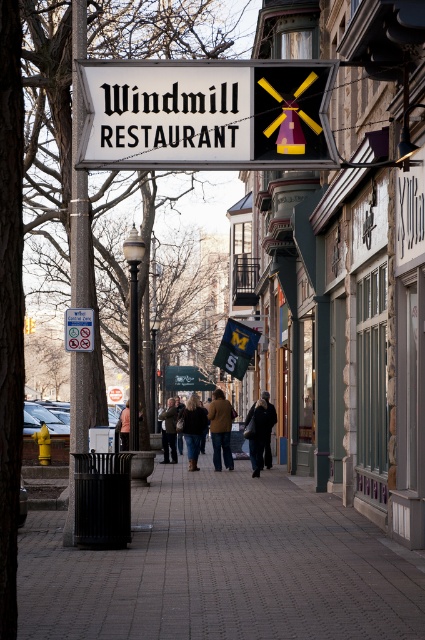
You are standing on the sidewalk of the urban street scene described. You want to read the matte black sign at upper center clearly. Considering the distance between you and the sign, is it possible to read the text on the sign without moving closer?

The matte black sign at upper center is 13.26 meters away from the viewer. At this distance, it may be challenging to read the text clearly without moving closer, as standard sign legibility typically requires closer proximity.

You are a delivery person trying to find the entrance to the Windmill Restaurant. You see the paved brick sidewalk at center and the matte black sign at upper center. According to the scene, which object is positioned lower in the image?

The paved brick sidewalk at center is located below the matte black sign at upper center, so the paved brick sidewalk at center is positioned lower in the image.

You are standing on the sidewalk in front of the Windmill Restaurant, and you notice two points marked on the cobblestone street. The first point is at coordinates point [189,586] and the second is at point [306,150]. Which of these two points is closer to you?

Point [189,586] is closer to the viewer than point [306,150].